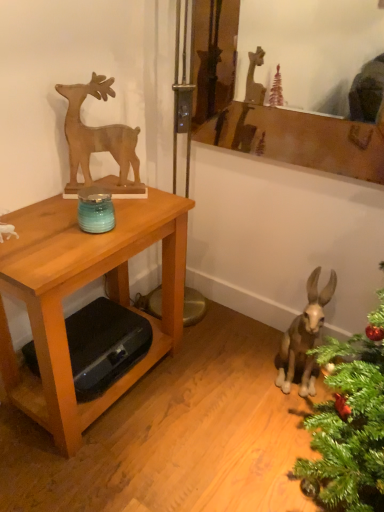
The image size is (384, 512). In order to click on vacant area on the back side of brown matte donkey at lower right in this screenshot , I will do `click(263, 352)`.